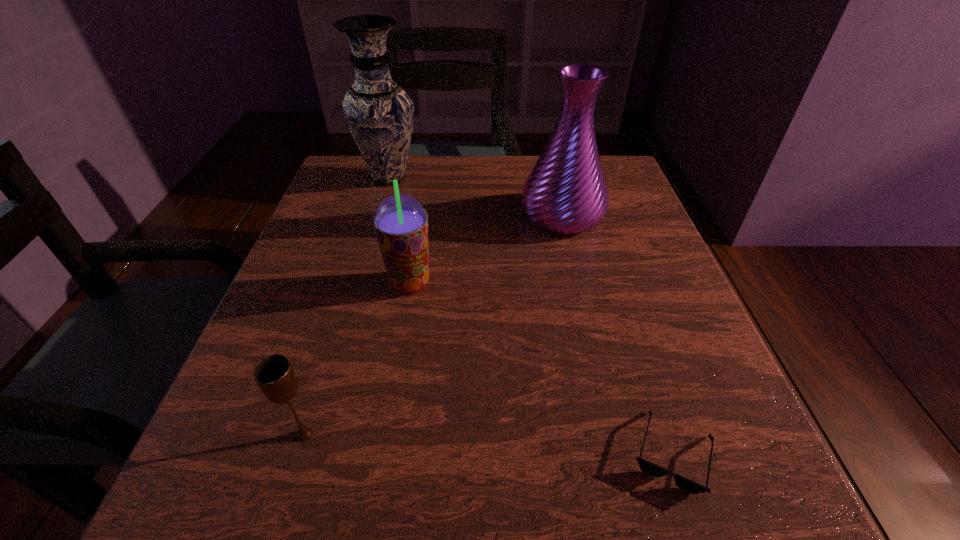
The image size is (960, 540). I want to click on vacant area between the sunglasses and the right vase, so click(x=617, y=334).

This screenshot has height=540, width=960. Find the location of `empty space that is in between the third shortest object and the sunglasses`. empty space that is in between the third shortest object and the sunglasses is located at coordinates (541, 368).

Locate an element on the screen. The width and height of the screenshot is (960, 540). free area in between the third shortest object and the right vase is located at coordinates [486, 249].

Where is `object identified as the closest to the left vase`? This screenshot has width=960, height=540. object identified as the closest to the left vase is located at coordinates (566, 192).

What are the coordinates of `the fourth closest object to the smoothie` in the screenshot? It's located at (647, 467).

This screenshot has height=540, width=960. I want to click on blank area in the image that satisfies the following two spatial constraints: 1. on the front side of the left vase; 2. on the right side of the right vase, so click(x=378, y=215).

You are a GUI agent. You are given a task and a screenshot of the screen. Output one action in this format:
    pyautogui.click(x=<x>, y=<y>)
    Task: Click on the free spot that satisfies the following two spatial constraints: 1. on the back side of the left vase; 2. on the left side of the second shortest object
    This screenshot has height=540, width=960.
    Given the screenshot: What is the action you would take?
    pyautogui.click(x=384, y=178)